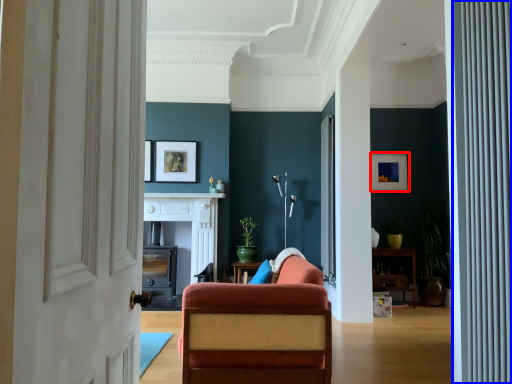
Question: Which object is closer to the camera taking this photo, picture frame (highlighted by a red box) or curtain (highlighted by a blue box)?

Choices:
 (A) picture frame
 (B) curtain

Answer: (B)